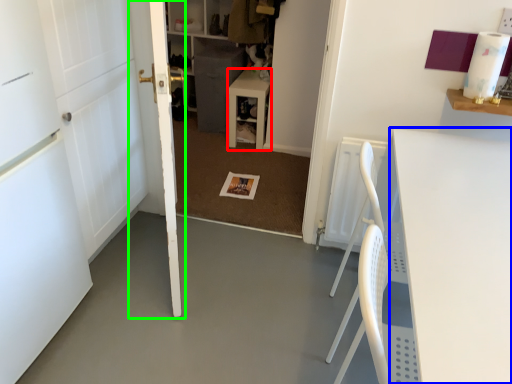
Question: Which object is positioned closest to table (highlighted by a red box)? Select from table (highlighted by a blue box) and door (highlighted by a green box).

Choices:
 (A) table
 (B) door

Answer: (B)